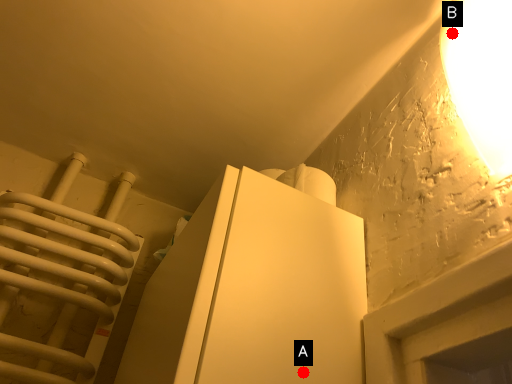
Question: Two points are circled on the image, labeled by A and B beside each circle. Which point is closer to the camera?

Choices:
 (A) A is closer
 (B) B is closer

Answer: (A)